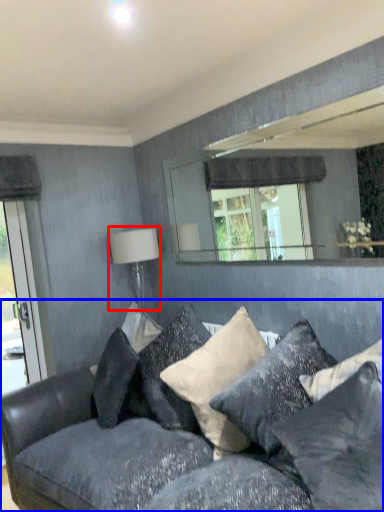
Question: Which object is closer to the camera taking this photo, table lamp (highlighted by a red box) or studio couch (highlighted by a blue box)?

Choices:
 (A) table lamp
 (B) studio couch

Answer: (B)